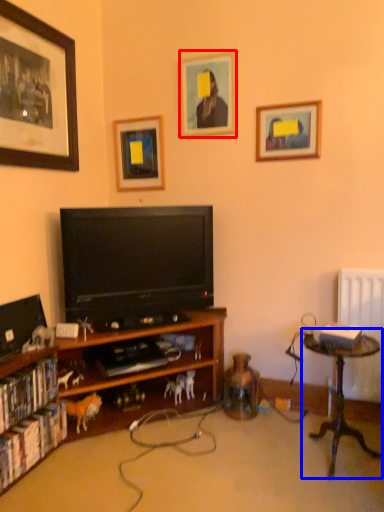
Question: Which point is closer to the camera, picture frame (highlighted by a red box) or table (highlighted by a blue box)?

Choices:
 (A) picture frame
 (B) table

Answer: (B)